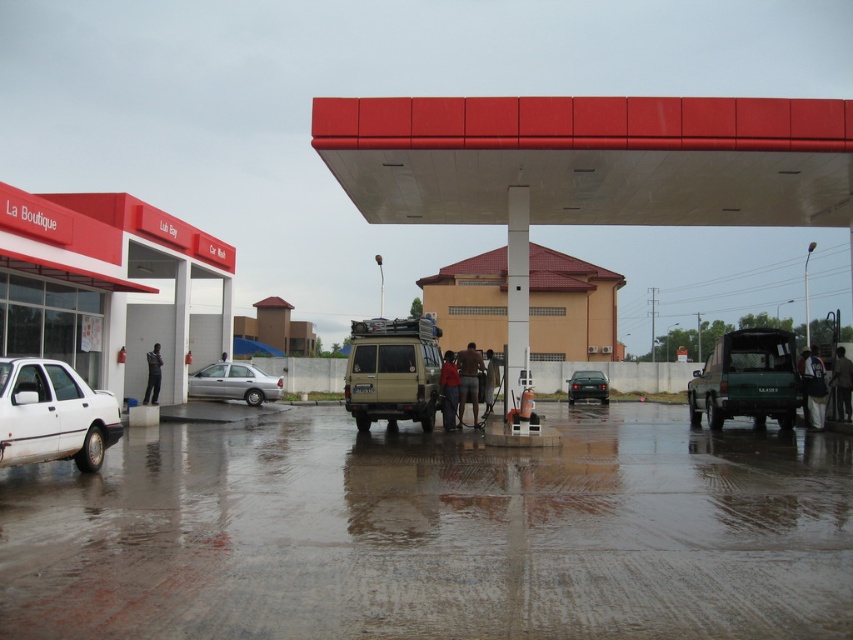
You are standing at the entrance of the gas station and notice a brown fabric shirt at lower right and a black fabric person at center. Which one is nearer to you?

The brown fabric shirt at lower right is closer to the viewer than the black fabric person at center.

You are a delivery driver who needs to park your truck at the gas station. The truck is 2 meters wide. Can you park your truck at the white matte gas station at left without overlapping the brown textured shorts at center?

The white matte gas station at left might be wider than brown textured shorts at center, so it is possible that the truck can park there without overlapping, but there is uncertainty due to the comparative width.

You are a delivery person standing at the entrance of the gas station. You need to deliver a package to the brown textured shorts at center and the black fabric person at center. The delivery robot you have can only travel 30 feet before needing a recharge. Can the robot deliver both items without needing to recharge?

The distance between the brown textured shorts at center and the black fabric person at center is 36.79 feet. Since the robot can only travel 30 feet before needing a recharge, it cannot deliver both items without recharging.